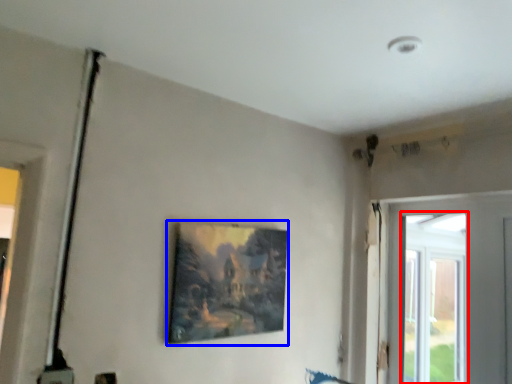
Question: Which point is further to the camera, window (highlighted by a red box) or picture frame (highlighted by a blue box)?

Choices:
 (A) window
 (B) picture frame

Answer: (A)